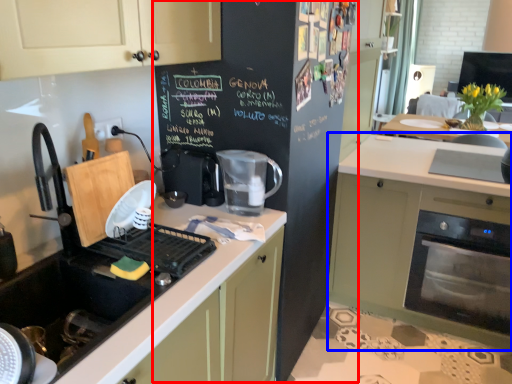
Question: Which point is closer to the camera, bulletin board (highlighted by a red box) or cabinetry (highlighted by a blue box)?

Choices:
 (A) bulletin board
 (B) cabinetry

Answer: (A)